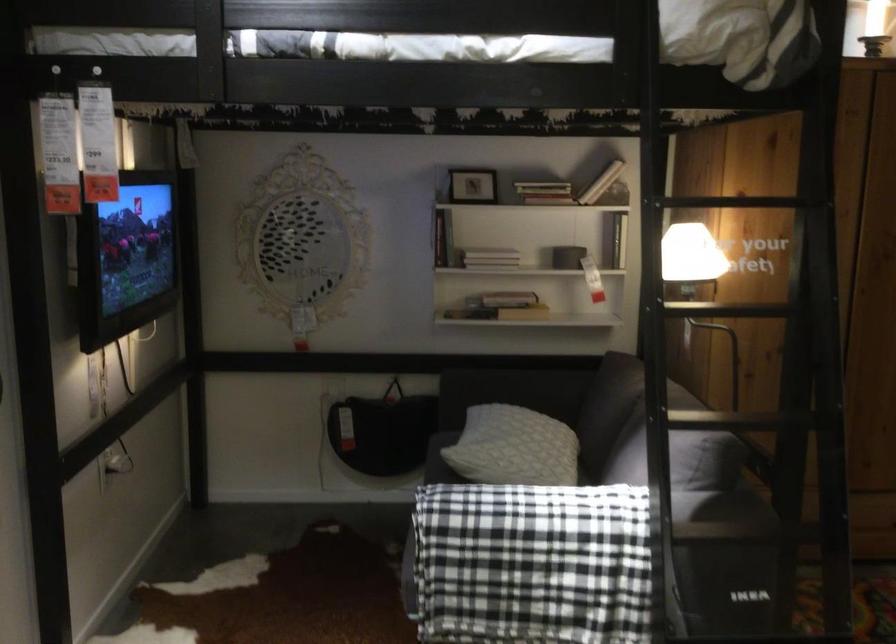
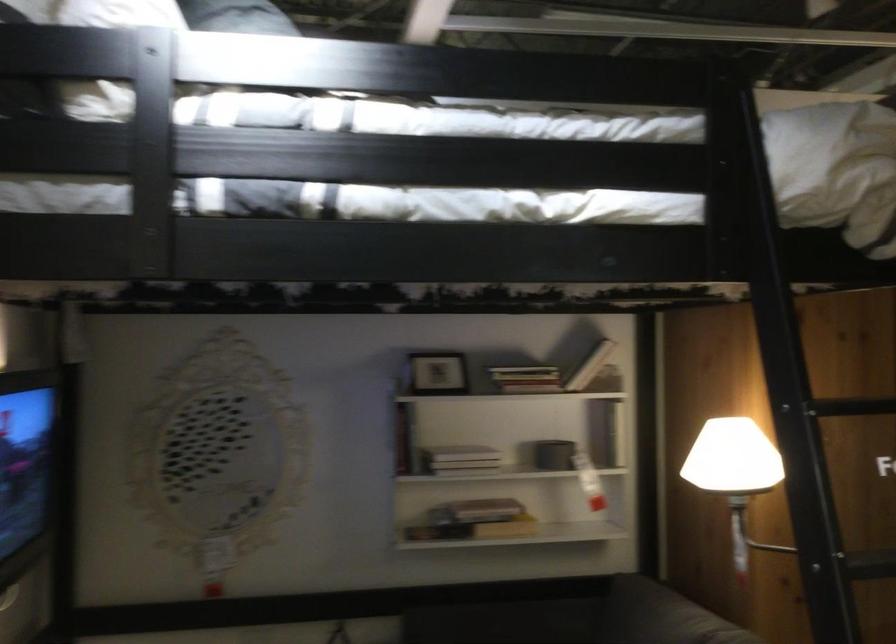
Find the pixel in the second image that matches [501,306] in the first image.

(474, 529)